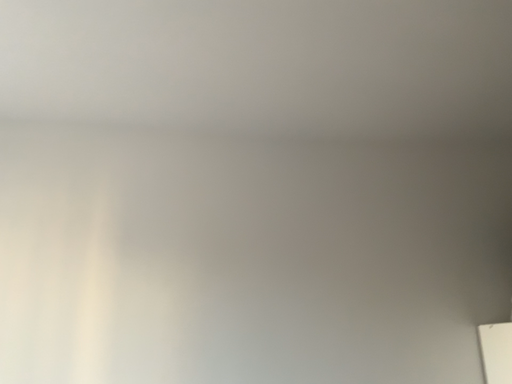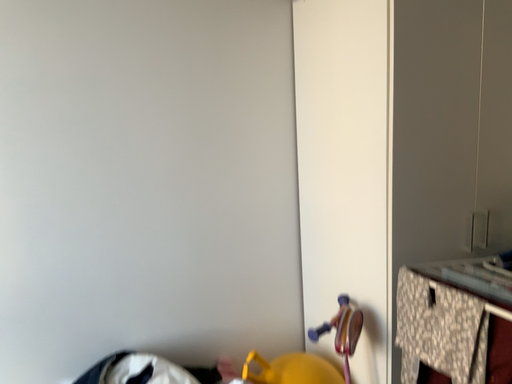
Question: Which way did the camera rotate in the video?

Choices:
 (A) rotated right
 (B) rotated left

Answer: (A)